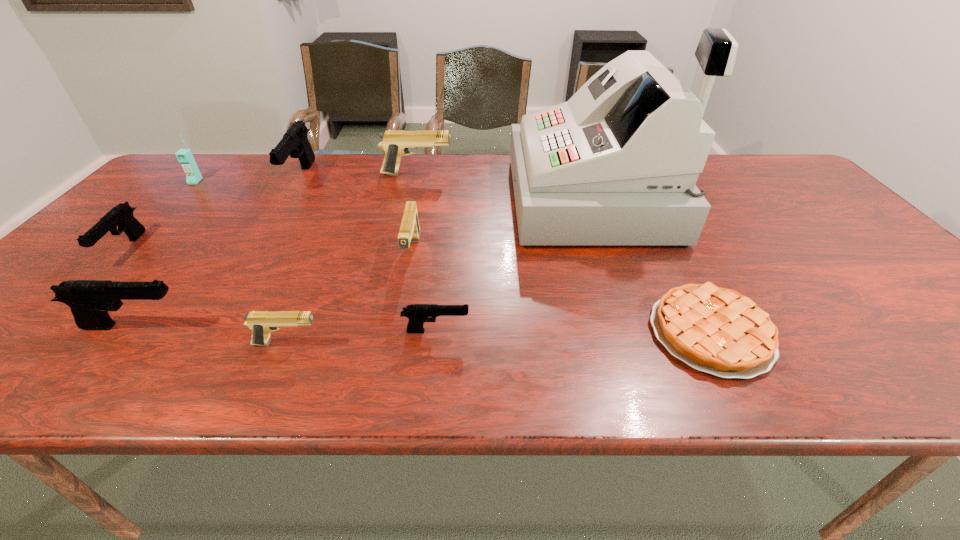
Locate an element on the screen. vacant area situated 0.220m at the barrel of the biggest tan pistol is located at coordinates (521, 174).

Identify the location of free region located on the front-facing side of the sixth pistol from right to left. The image size is (960, 540). (375, 326).

Where is `free region located 0.200m at the barrel of the second biggest tan pistol`? free region located 0.200m at the barrel of the second biggest tan pistol is located at coordinates (396, 343).

Locate an element on the screen. This screenshot has height=540, width=960. free space located 0.120m on the front-facing side of the leftmost black pistol is located at coordinates (66, 308).

Where is `free region located 0.270m at the barrel of the nearest tan pistol`? This screenshot has height=540, width=960. free region located 0.270m at the barrel of the nearest tan pistol is located at coordinates (457, 343).

I want to click on vacant space situated on the front-facing side of the smallest black pistol, so click(601, 331).

Where is `free location located on the left of the shortest object`? free location located on the left of the shortest object is located at coordinates (603, 333).

The height and width of the screenshot is (540, 960). I want to click on cash register at the far edge, so click(x=617, y=164).

I want to click on cellular telephone situated at the far edge, so click(x=193, y=176).

Where is `object at the near edge`? object at the near edge is located at coordinates (719, 331).